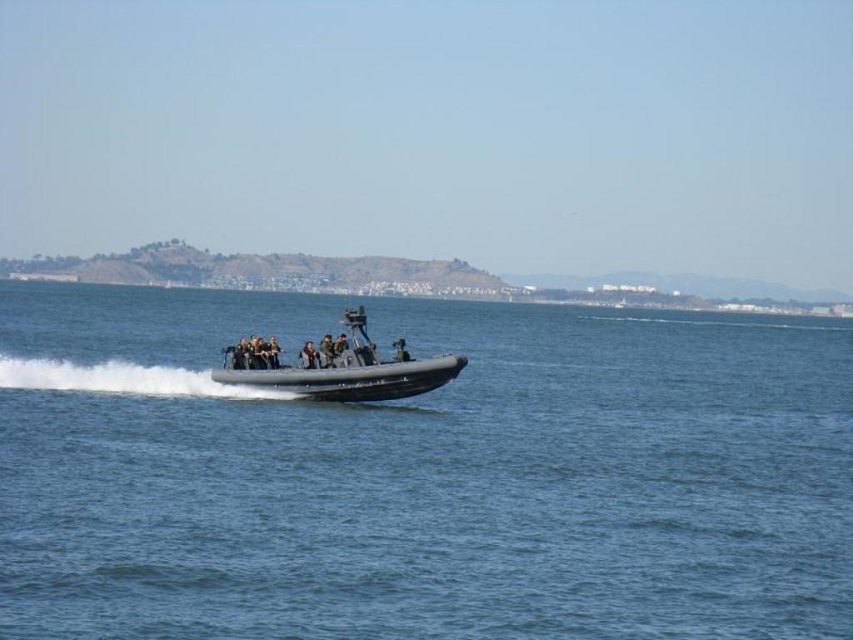
You are a drone operator tasked with monitoring the scene. The clear blue water at center and the black matte uniform at center are both within your field of view. How far apart are these two objects in meters?

The distance between the clear blue water at center and the black matte uniform at center is 49.51 meters.

You are a drone operator controlling a drone that needs to hover exactly at point (439,365). The drone has a maximum flight range of 70 meters. Can the drone reach that point without exceeding its range?

The distance of point (439,365) from camera is 68.47 meters, so yes, the drone can reach that point since it is within the 70 meters range.